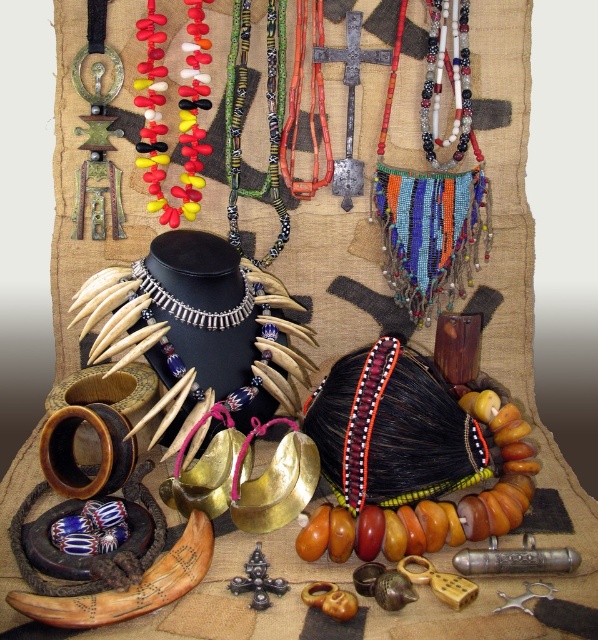
Question: Which is nearer to the rubber beads necklace at center?

Choices:
 (A) multicolored beaded necklace at center
 (B) beaded fabric necklace at center
 (C) silver metallic necklace at center

Answer: (A)

Question: Does multicolored beaded necklace at center have a greater width compared to silver metallic necklace at center?

Choices:
 (A) yes
 (B) no

Answer: (B)

Question: Is rubber beads necklace at center thinner than silver metallic necklace at center?

Choices:
 (A) yes
 (B) no

Answer: (A)

Question: Which point is closer to the camera?

Choices:
 (A) (147, 268)
 (B) (233, 88)
 (C) (459, 140)

Answer: (A)

Question: Based on their relative distances, which object is nearer to the multicolored beaded necklace at center?

Choices:
 (A) silver metallic necklace at center
 (B) rubber beads necklace at center
 (C) beaded fabric necklace at center

Answer: (B)

Question: Does rubber beads necklace at center have a larger size compared to silver metallic necklace at center?

Choices:
 (A) yes
 (B) no

Answer: (A)